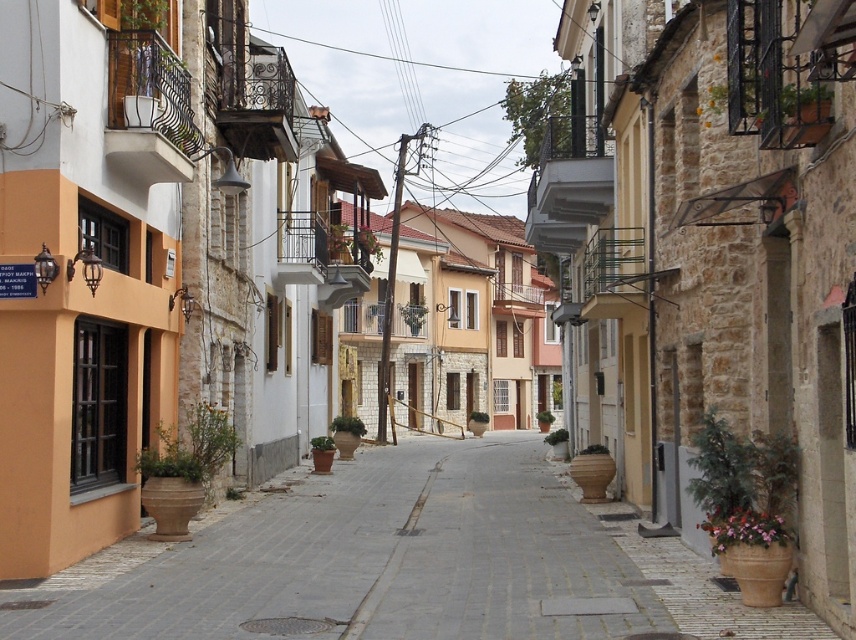
Question: Observing the image, what is the correct spatial positioning of terracotta clay pots at center in reference to smooth concrete sidewalk at center?

Choices:
 (A) below
 (B) above

Answer: (B)

Question: Does terracotta clay pots at center have a lesser width compared to smooth concrete sidewalk at center?

Choices:
 (A) yes
 (B) no

Answer: (B)

Question: Is terracotta clay pots at center to the left of smooth concrete sidewalk at center from the viewer's perspective?

Choices:
 (A) yes
 (B) no

Answer: (A)

Question: Which point is closer to the camera?

Choices:
 (A) (575, 534)
 (B) (409, 538)

Answer: (B)